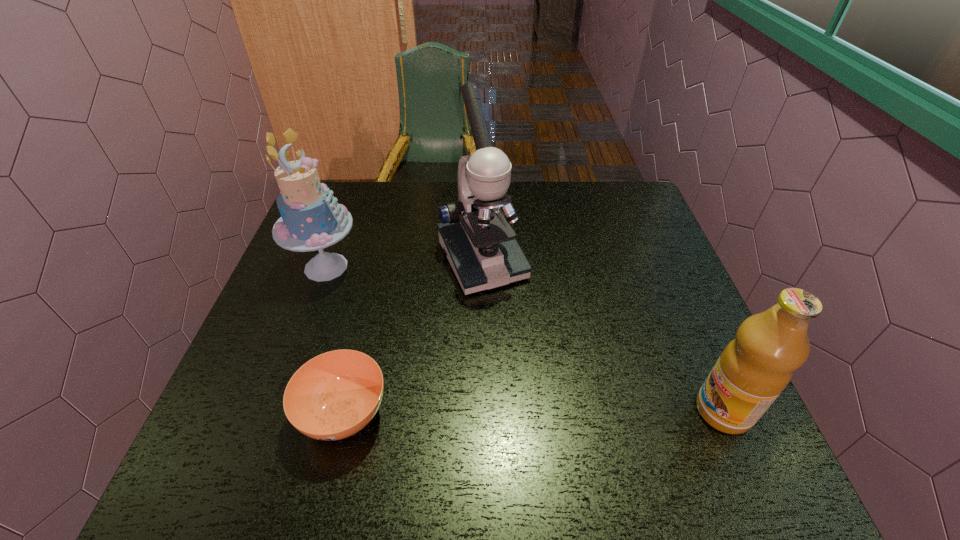
At what (x,y) coordinates should I click in order to perform the action: click on free spot located at the eyepiece of the second object from right to left. Please return your answer as a coordinate pair (x, y). Image resolution: width=960 pixels, height=540 pixels. Looking at the image, I should click on (510, 313).

You are a GUI agent. You are given a task and a screenshot of the screen. Output one action in this format:
    pyautogui.click(x=<x>, y=<y>)
    Task: Click on the free region located at the eyepiece of the second object from right to left
    
    Given the screenshot: What is the action you would take?
    pyautogui.click(x=525, y=340)

The width and height of the screenshot is (960, 540). I want to click on vacant area situated with a ladder on the side of the cake, so click(414, 321).

This screenshot has height=540, width=960. Find the location of `free spot located with a ladder on the side of the cake`. free spot located with a ladder on the side of the cake is located at coordinates (446, 341).

This screenshot has height=540, width=960. I want to click on blank space located 0.090m with a ladder on the side of the cake, so click(x=374, y=297).

Find the location of `soup bowl that is at the near edge`. soup bowl that is at the near edge is located at coordinates (334, 395).

The width and height of the screenshot is (960, 540). I want to click on olive oil at the near edge, so click(x=754, y=368).

Find the location of a particular element. soup bowl located at the left edge is located at coordinates (334, 395).

The image size is (960, 540). In order to click on cake that is at the left edge in this screenshot , I will do coord(311,219).

The image size is (960, 540). I want to click on object positioned at the right edge, so [x=754, y=368].